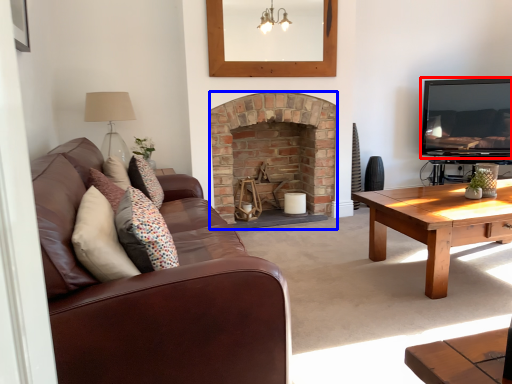
Question: Which object appears closest to the camera in this image, television (highlighted by a red box) or fireplace (highlighted by a blue box)?

Choices:
 (A) television
 (B) fireplace

Answer: (B)